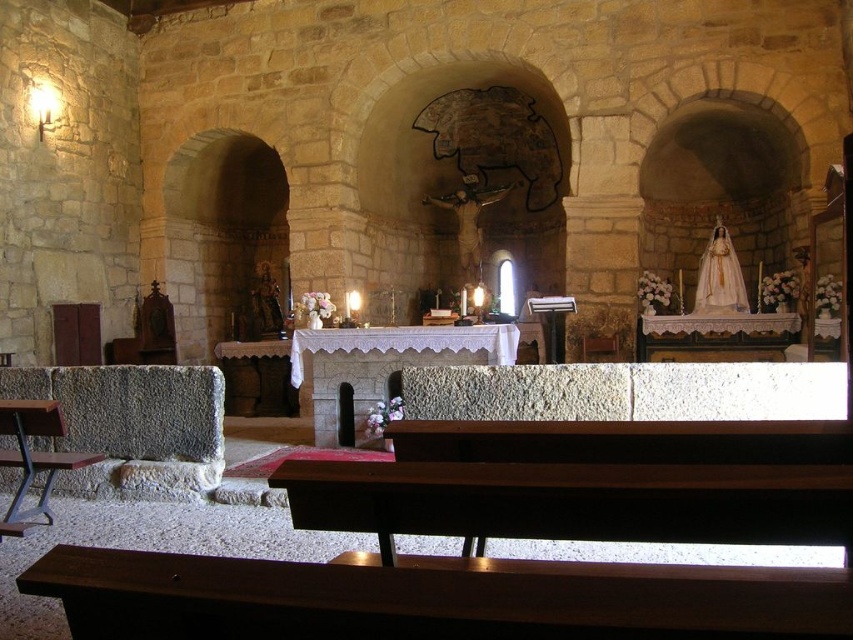
You are a visitor standing at the entrance of the church. You notice the smooth brown wood at lower center and the white stone altar at center. Which object is narrower in width?

The smooth brown wood at lower center is thinner than the white stone altar at center, so the smooth brown wood at lower center is narrower in width.

You are a visitor standing at the entrance of the church. You see the wooden polished bench at lower center and the white stone altar at center. Which object is closer to you?

The wooden polished bench at lower center is closer to you because it is positioned below the white stone altar at center, indicating it is nearer in the viewing perspective.